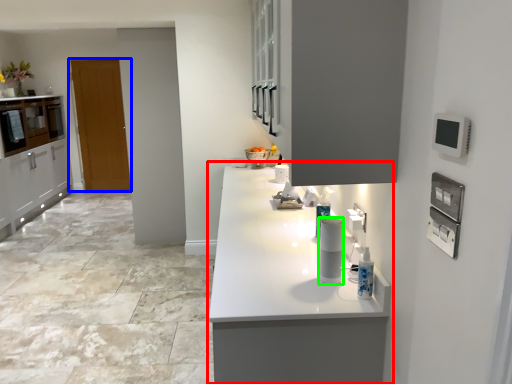
Question: Considering the real-world distances, which object is farthest from countertop (highlighted by a red box)? door (highlighted by a blue box) or appliance (highlighted by a green box)?

Choices:
 (A) door
 (B) appliance

Answer: (A)